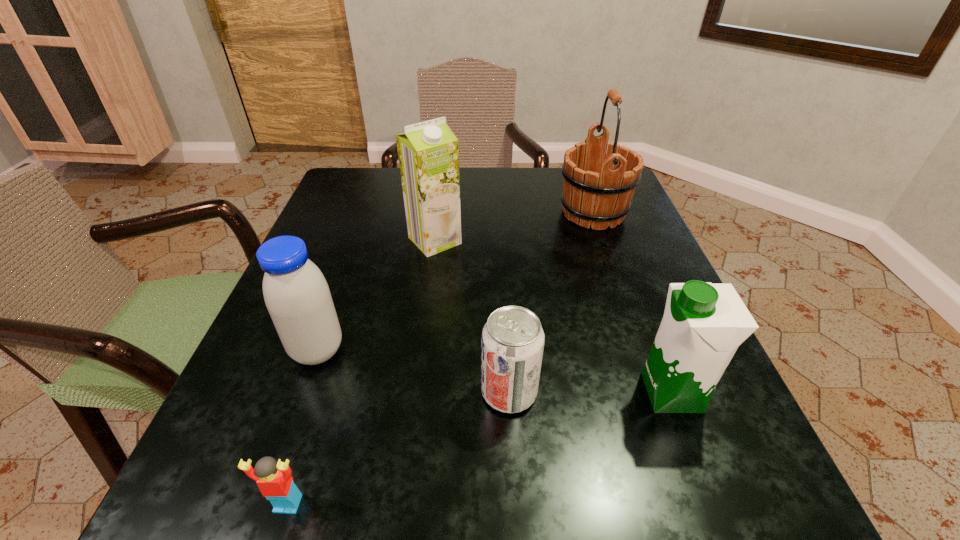
I want to click on wine bucket present at the right edge, so click(598, 186).

Find the location of `soya milk located at the right edge`. soya milk located at the right edge is located at coordinates (703, 325).

At what (x,y) coordinates should I click in order to perform the action: click on object that is at the near left corner. Please return your answer as a coordinate pair (x, y). Looking at the image, I should click on (274, 480).

At what (x,y) coordinates should I click in order to perform the action: click on object present at the far right corner. Please return your answer as a coordinate pair (x, y). The width and height of the screenshot is (960, 540). Looking at the image, I should click on (598, 186).

You are a GUI agent. You are given a task and a screenshot of the screen. Output one action in this format:
    pyautogui.click(x=<x>, y=<y>)
    Task: Click on the vacant position at the far edge of the desktop
    This screenshot has height=540, width=960.
    Given the screenshot: What is the action you would take?
    pyautogui.click(x=545, y=189)

Identify the location of vacant space at the near edge of the desktop. (582, 479).

Locate an element on the screen. This screenshot has height=540, width=960. vacant position at the left edge of the desktop is located at coordinates (365, 226).

You are a GUI agent. You are given a task and a screenshot of the screen. Output one action in this format:
    pyautogui.click(x=<x>, y=<y>)
    Task: Click on the vacant space at the right edge of the desktop
    The width and height of the screenshot is (960, 540).
    Given the screenshot: What is the action you would take?
    pyautogui.click(x=622, y=394)

Where is `vacant space at the far left corner`? The height and width of the screenshot is (540, 960). vacant space at the far left corner is located at coordinates (353, 167).

At what (x,y) coordinates should I click in order to perform the action: click on empty space that is in between the leftmost soya milk and the wine bucket. Please return your answer as a coordinate pair (x, y). This screenshot has height=540, width=960. Looking at the image, I should click on (455, 282).